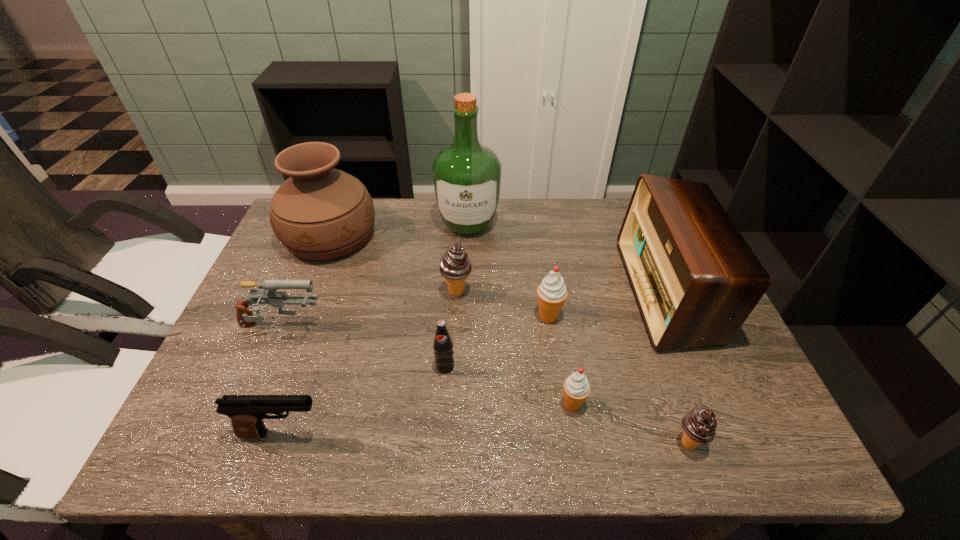
This screenshot has height=540, width=960. Find the location of `green liquor`. green liquor is located at coordinates (467, 175).

Locate an element on the screen. liquor is located at coordinates (467, 175).

Find the location of `urn`. urn is located at coordinates (319, 213).

You are a GUI agent. You are given a task and a screenshot of the screen. Output one action in this format:
    pyautogui.click(x=<x>, y=<y>)
    Task: Click on the radio receiver
    Image resolution: width=960 pixels, height=540 pixels.
    Given the screenshot: What is the action you would take?
    pyautogui.click(x=695, y=279)

Where is `the second farthest icecream`? The height and width of the screenshot is (540, 960). the second farthest icecream is located at coordinates (551, 293).

You are a GUI agent. You are given a task and a screenshot of the screen. Output one action in this format:
    pyautogui.click(x=<x>, y=<y>)
    Task: Click on the farther red icecream
    The width and height of the screenshot is (960, 540).
    Given the screenshot: What is the action you would take?
    pyautogui.click(x=551, y=293)

You are a GUI agent. You are given a task and a screenshot of the screen. Output one action in this format:
    pyautogui.click(x=<x>, y=<y>)
    Task: Click on the left chocolate icecream
    The width and height of the screenshot is (960, 540).
    Given the screenshot: What is the action you would take?
    pyautogui.click(x=455, y=266)

Locate an element on the screen. The image size is (960, 540). the farther chocolate icecream is located at coordinates coord(455,266).

Locate an element on the screen. black pop is located at coordinates 443,345.

Locate an element on the screen. pop is located at coordinates (443, 345).